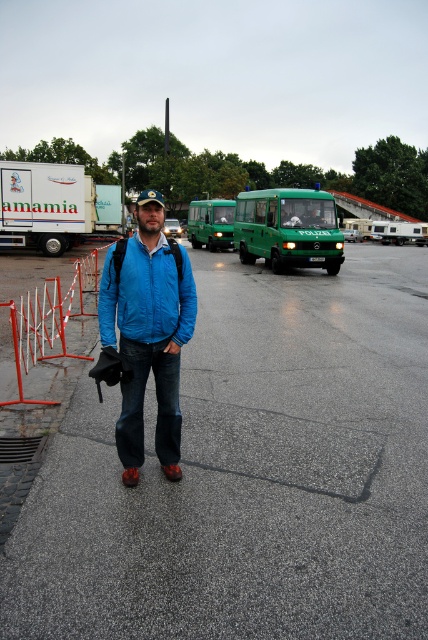
Consider the image. Does gray asphalt pavement at center have a lesser height compared to white matte truck at left?

Correct, gray asphalt pavement at center is not as tall as white matte truck at left.

Is point (311, 609) farther from viewer compared to point (83, 200)?

No.

Identify the location of gray asphalt pavement at center. (249, 474).

Does blue matte jacket at center have a greater height compared to green matte van at center?

No, blue matte jacket at center is not taller than green matte van at center.

Is point (163, 396) closer to viewer compared to point (329, 257)?

Yes, it is in front of point (329, 257).

Locate an element on the screen. blue matte jacket at center is located at coordinates (148, 332).

Image resolution: width=428 pixels, height=640 pixels. In order to click on blue matte jacket at center in this screenshot , I will do `click(148, 332)`.

Consider the image. How much distance is there between white matte truck at left and red metal barricade at left?

white matte truck at left and red metal barricade at left are 9.93 meters apart from each other.

Is white matte truck at left bigger than red metal barricade at left?

Indeed, white matte truck at left has a larger size compared to red metal barricade at left.

Where is `white matte truck at left`? The image size is (428, 640). white matte truck at left is located at coordinates (53, 205).